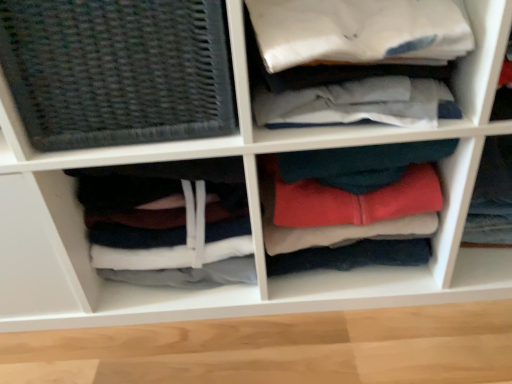
Question: Can you confirm if dark gray woven mat at left is wider than red fleece hoodie at center, marked as the 1th clothing in a right-to-left arrangement?

Choices:
 (A) no
 (B) yes

Answer: (B)

Question: Is dark gray woven mat at left looking in the opposite direction of red fleece hoodie at center, marked as the 1th clothing in a right-to-left arrangement?

Choices:
 (A) yes
 (B) no

Answer: (B)

Question: Considering the relative sizes of dark gray woven mat at left and red fleece hoodie at center, the third clothing in the left-to-right sequence, in the image provided, is dark gray woven mat at left shorter than red fleece hoodie at center, the third clothing in the left-to-right sequence,?

Choices:
 (A) no
 (B) yes

Answer: (A)

Question: Is the depth of dark gray woven mat at left greater than that of red fleece hoodie at center, the third clothing in the left-to-right sequence?

Choices:
 (A) no
 (B) yes

Answer: (A)

Question: Considering the relative positions of dark gray woven mat at left and red fleece hoodie at center, the third clothing in the left-to-right sequence, in the image provided, is dark gray woven mat at left to the right of red fleece hoodie at center, the third clothing in the left-to-right sequence, from the viewer's perspective?

Choices:
 (A) no
 (B) yes

Answer: (A)

Question: Is red fleece hoodie at center, the third clothing in the left-to-right sequence, surrounded by dark gray woven mat at left?

Choices:
 (A) yes
 (B) no

Answer: (B)

Question: Is soft fleece hoodie at center, the 2th clothing from the left, positioned beyond the bounds of red fleece hoodie at center, marked as the 1th clothing in a right-to-left arrangement?

Choices:
 (A) no
 (B) yes

Answer: (B)

Question: Does soft fleece hoodie at center, which is the second clothing from right to left, have a larger size compared to red fleece hoodie at center, marked as the 1th clothing in a right-to-left arrangement?

Choices:
 (A) no
 (B) yes

Answer: (B)

Question: Are soft fleece hoodie at center, which is the second clothing from right to left, and red fleece hoodie at center, the third clothing in the left-to-right sequence, located far from each other?

Choices:
 (A) yes
 (B) no

Answer: (B)

Question: Can you confirm if soft fleece hoodie at center, which is the second clothing from right to left, is wider than red fleece hoodie at center, the third clothing in the left-to-right sequence?

Choices:
 (A) no
 (B) yes

Answer: (A)

Question: Considering the relative sizes of soft fleece hoodie at center, which is the second clothing from right to left, and red fleece hoodie at center, marked as the 1th clothing in a right-to-left arrangement, in the image provided, is soft fleece hoodie at center, which is the second clothing from right to left, taller than red fleece hoodie at center, marked as the 1th clothing in a right-to-left arrangement,?

Choices:
 (A) no
 (B) yes

Answer: (B)

Question: Is soft fleece hoodie at center, the 2th clothing from the left, thinner than red fleece hoodie at center, the third clothing in the left-to-right sequence?

Choices:
 (A) yes
 (B) no

Answer: (A)

Question: Considering the relative positions of dark gray woven mat at left and dark gray fabric at lower left, which ranks as the 1th clothing in left-to-right order, in the image provided, is dark gray woven mat at left to the left of dark gray fabric at lower left, which ranks as the 1th clothing in left-to-right order, from the viewer's perspective?

Choices:
 (A) yes
 (B) no

Answer: (A)